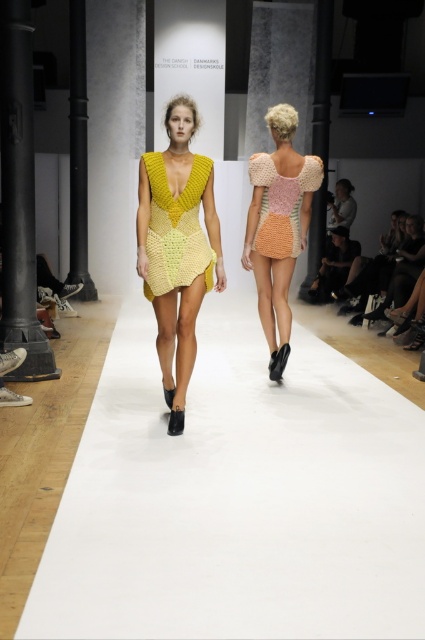
Question: In this image, where is yellow knitted dress at center located relative to textured crochet dress at back?

Choices:
 (A) below
 (B) above

Answer: (A)

Question: Which is farther from the textured crochet dress at back?

Choices:
 (A) yellow crocheted dress at center
 (B) knitted fabric dress at center
 (C) black metal pole at left

Answer: (C)

Question: Is yellow knitted dress at center below yellow crocheted dress at center?

Choices:
 (A) yes
 (B) no

Answer: (A)

Question: Among these points, which one is nearest to the camera?

Choices:
 (A) (25, 305)
 (B) (288, 214)

Answer: (B)

Question: Which object is farther from the camera taking this photo?

Choices:
 (A) textured crochet dress at back
 (B) knitted fabric dress at center

Answer: (A)

Question: Is yellow knitted dress at center closer to camera compared to textured crochet dress at back?

Choices:
 (A) yes
 (B) no

Answer: (A)